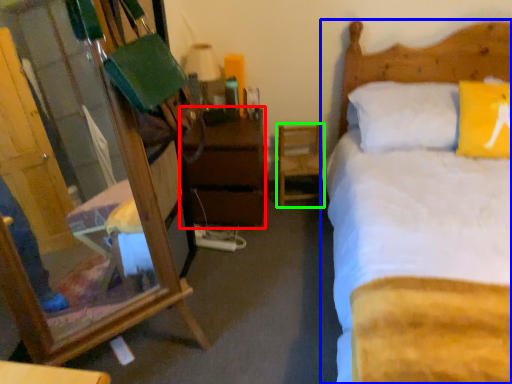
Question: Estimate the real-world distances between objects in this image. Which object is farther from nightstand (highlighted by a red box), bed (highlighted by a blue box) or chair (highlighted by a green box)?

Choices:
 (A) bed
 (B) chair

Answer: (A)